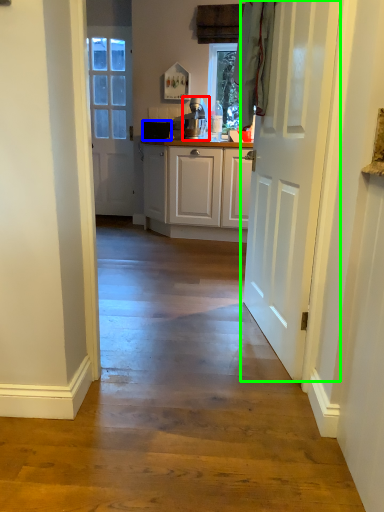
Question: Considering the real-world distances, which object is closest to appliance (highlighted by a red box)? appliance (highlighted by a blue box) or door (highlighted by a green box).

Choices:
 (A) appliance
 (B) door

Answer: (A)